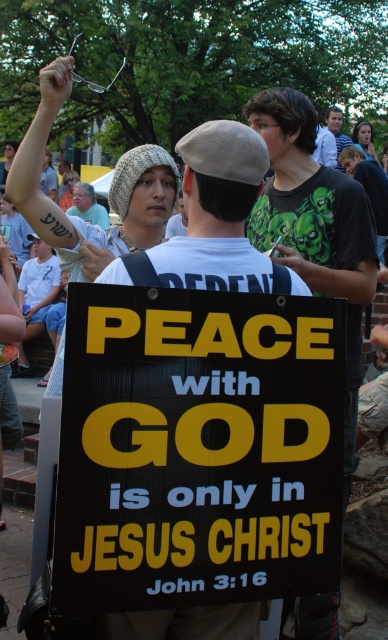
Question: Which point is closer to the camera?

Choices:
 (A) green t-shirt at center
 (B) beige knit hat at upper center
 (C) yellow/black cardboard sign at center

Answer: (C)

Question: Does yellow/black cardboard sign at center have a smaller size compared to beige knit hat at upper center?

Choices:
 (A) yes
 (B) no

Answer: (A)

Question: Which of the following is the closest to the observer?

Choices:
 (A) (275, 369)
 (B) (95, 211)
 (C) (334, 132)

Answer: (A)

Question: Does yellow/black cardboard sign at center appear on the right side of green t-shirt at center?

Choices:
 (A) no
 (B) yes

Answer: (A)

Question: Estimate the real-world distances between objects in this image. Which object is closer to the yellow/black cardboard sign at center?

Choices:
 (A) green t-shirt at center
 (B) beige knit hat at upper center

Answer: (B)

Question: Is beige knit hat at upper center below green t-shirt at center?

Choices:
 (A) no
 (B) yes

Answer: (B)